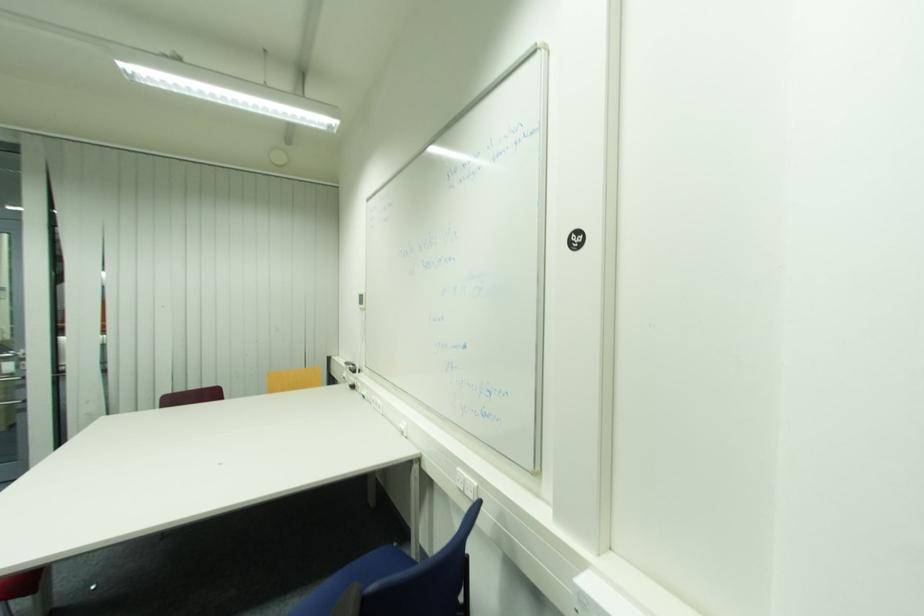
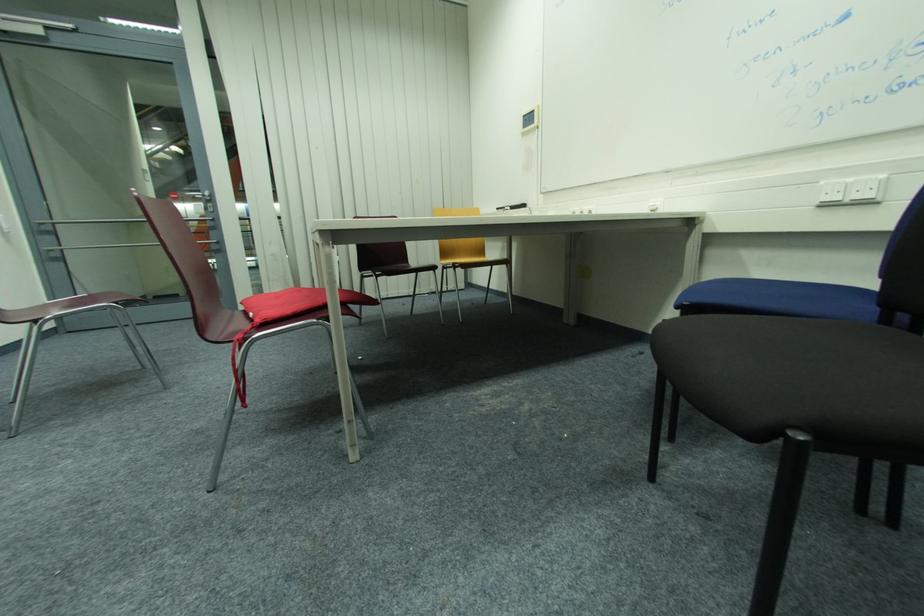
Question: In a continuous first-person perspective shot, in which direction is the camera moving?

Choices:
 (A) Left
 (B) Right
 (C) Forward
 (D) Backward

Answer: (A)